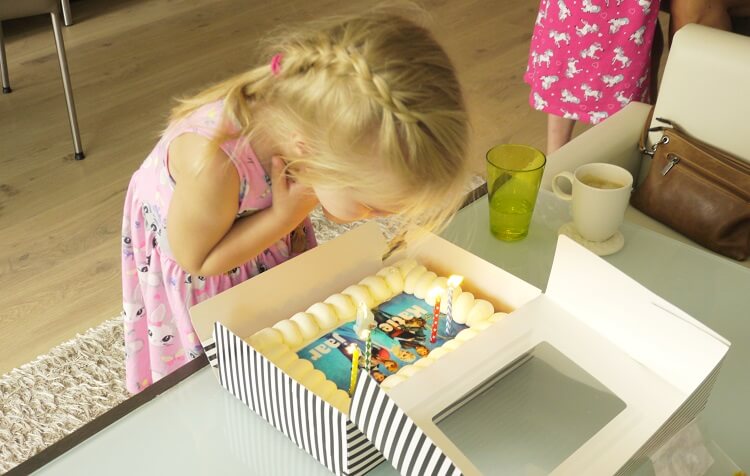
In order to click on candles in this screenshot , I will do `click(446, 319)`, `click(435, 325)`, `click(366, 347)`, `click(355, 368)`.